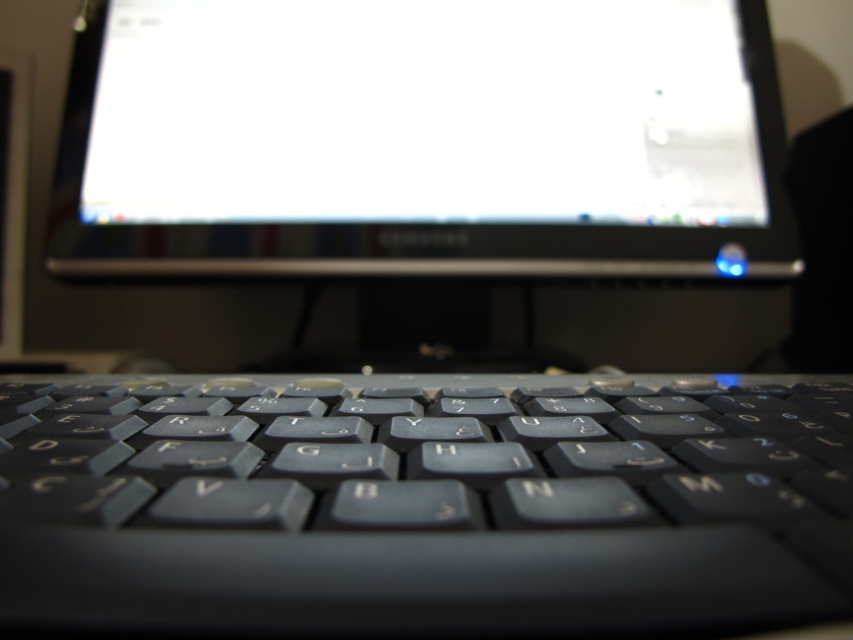
Question: Is matte black keyboard at center above satin black monitor at center?

Choices:
 (A) no
 (B) yes

Answer: (A)

Question: Which point is farther from the camera taking this photo?

Choices:
 (A) (405, 140)
 (B) (392, 481)

Answer: (A)

Question: Does matte black keyboard at center appear on the left side of satin black monitor at center?

Choices:
 (A) yes
 (B) no

Answer: (A)

Question: Does matte black keyboard at center appear on the left side of satin black monitor at center?

Choices:
 (A) yes
 (B) no

Answer: (A)